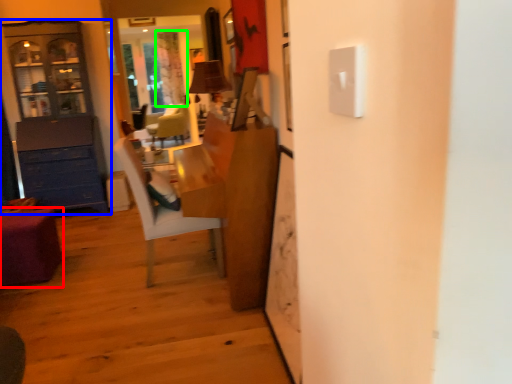
Question: Which object is positioned closest to desk (highlighted by a red box)? Select from cabinetry (highlighted by a blue box) and curtain (highlighted by a green box).

Choices:
 (A) cabinetry
 (B) curtain

Answer: (A)